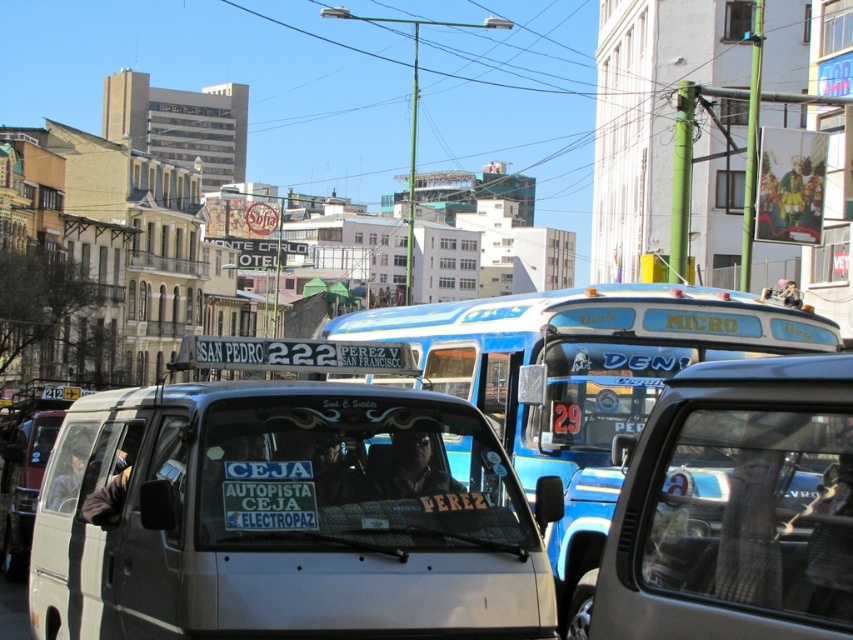
Question: Estimate the real-world distances between objects in this image. Which object is closer to the white matte van at center?

Choices:
 (A) blue metallic bus at center
 (B) metallic silver van at center

Answer: (B)

Question: Can you confirm if metallic silver van at center is smaller than blue metallic bus at center?

Choices:
 (A) no
 (B) yes

Answer: (A)

Question: Which point is closer to the camera?

Choices:
 (A) white matte van at center
 (B) blue metallic bus at center
 (C) metallic silver van at center

Answer: (C)

Question: Observing the image, what is the correct spatial positioning of white matte van at center in reference to blue metallic bus at center?

Choices:
 (A) above
 (B) below

Answer: (A)

Question: Is white matte van at center further to the viewer compared to metallic silver van at center?

Choices:
 (A) yes
 (B) no

Answer: (A)

Question: Which of the following is the farthest from the observer?

Choices:
 (A) white matte van at center
 (B) metallic silver van at center
 (C) blue metallic bus at center

Answer: (C)